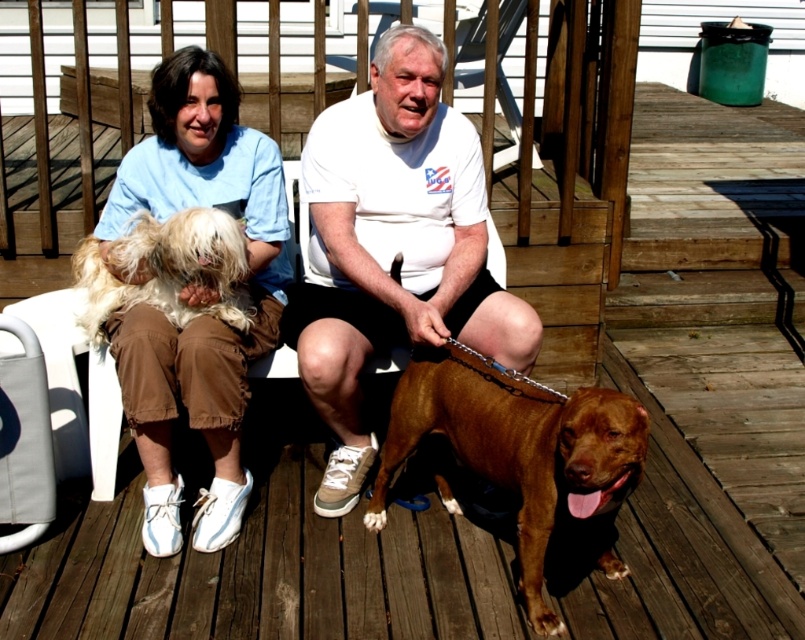
Is the position of light blue cotton shirt at upper left less distant than that of fluffy white fur at center?

Yes.

Where is `light blue cotton shirt at upper left`? light blue cotton shirt at upper left is located at coordinates (201, 314).

Which is in front, point (141, 360) or point (188, 228)?

Positioned in front is point (141, 360).

This screenshot has height=640, width=805. What are the coordinates of `light blue cotton shirt at upper left` in the screenshot? It's located at click(x=201, y=314).

Between white t-shirt at center and brown glossy dog at center, which one has more height?

white t-shirt at center is taller.

Who is shorter, white t-shirt at center or brown glossy dog at center?

brown glossy dog at center

The image size is (805, 640). In order to click on white t-shirt at center in this screenshot , I will do `click(393, 246)`.

Where is `white t-shirt at center`? The image size is (805, 640). white t-shirt at center is located at coordinates (393, 246).

Is point (180, 136) positioned after point (527, 445)?

Yes.

You are a GUI agent. You are given a task and a screenshot of the screen. Output one action in this format:
    pyautogui.click(x=<x>, y=<y>)
    Task: Click on the light blue cotton shirt at upper left
    
    Given the screenshot: What is the action you would take?
    pyautogui.click(x=201, y=314)